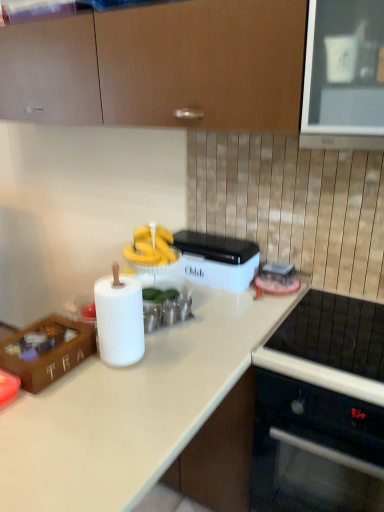
Locate an element on the screen. This screenshot has width=384, height=512. vacant space situated above wooden tea box at lower left (from a real-world perspective) is located at coordinates point(47,331).